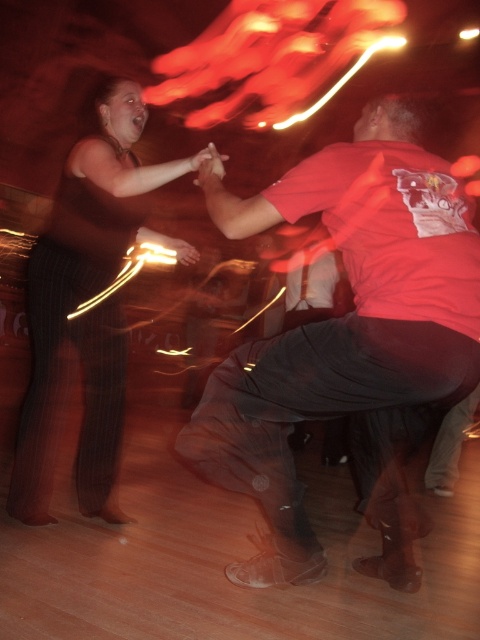
Is point (239, 230) farther from viewer compared to point (86, 380)?

No, it is not.

The image size is (480, 640). Identify the location of matte red shirt at center. (348, 339).